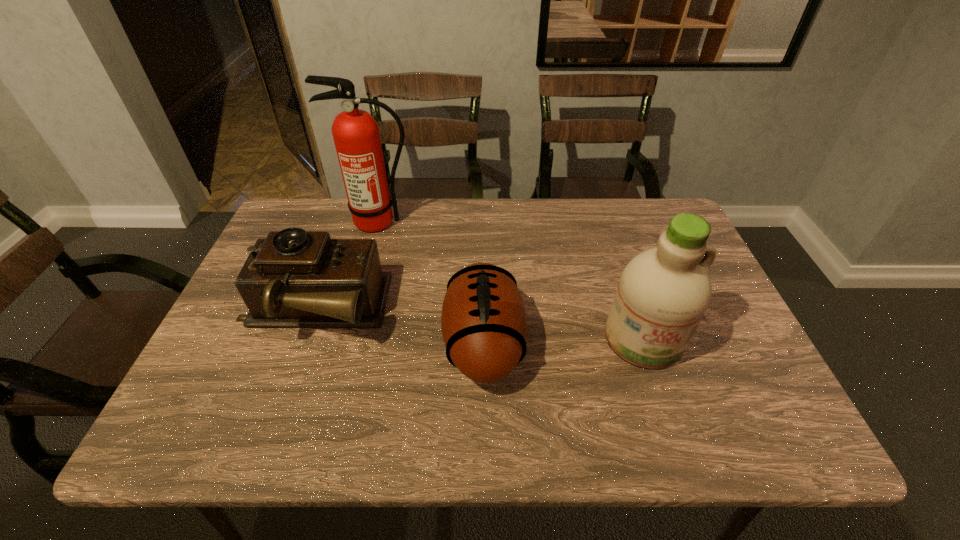
Identify the location of free region located on the right of the football (American). The height and width of the screenshot is (540, 960). (691, 342).

Identify the location of object situated at the far edge. The image size is (960, 540). (356, 135).

Find the location of a particular element. object that is positioned at the left edge is located at coordinates (293, 278).

Identify the location of object at the right edge. The height and width of the screenshot is (540, 960). (663, 293).

Where is `vacant space at the far edge of the desktop`? The image size is (960, 540). vacant space at the far edge of the desktop is located at coordinates pos(474,204).

Locate an element on the screen. vacant region at the near edge of the desktop is located at coordinates (543, 449).

In the image, there is a desktop. At what (x,y) coordinates should I click in order to perform the action: click on free space at the left edge. Please return your answer as a coordinate pair (x, y). The width and height of the screenshot is (960, 540). Looking at the image, I should click on (204, 376).

The image size is (960, 540). Find the location of `free space at the right edge`. free space at the right edge is located at coordinates (735, 342).

This screenshot has width=960, height=540. Identify the location of free space between the tallest object and the third object from left to right. (431, 282).

The height and width of the screenshot is (540, 960). What are the coordinates of `vacant point located between the football (American) and the third tallest object` in the screenshot? It's located at (398, 326).